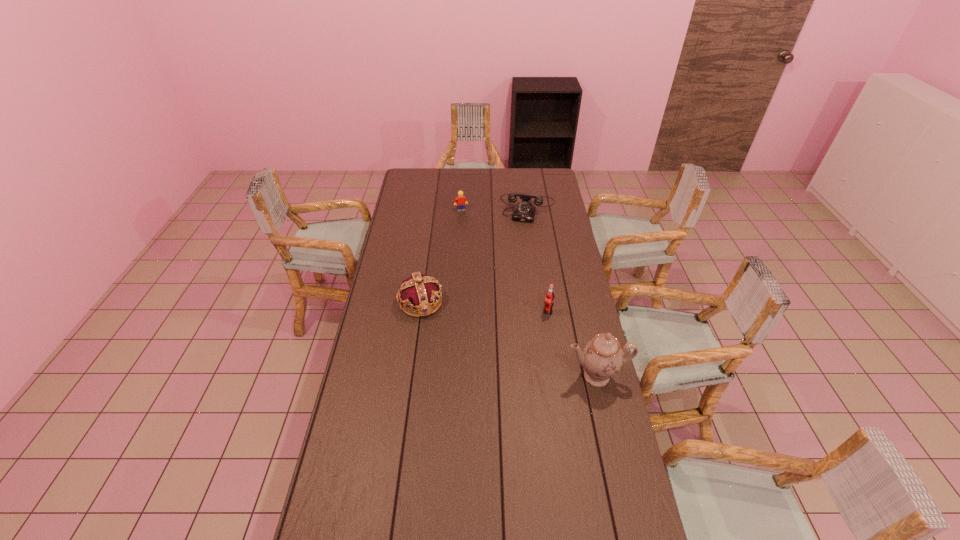
Locate an element on the screen. This screenshot has height=540, width=960. soda bottle positioned at the right edge is located at coordinates (549, 297).

You are a GUI agent. You are given a task and a screenshot of the screen. Output one action in this format:
    pyautogui.click(x=<x>, y=<y>)
    Task: Click on the free location at the far edge of the desktop
    The width and height of the screenshot is (960, 540).
    Given the screenshot: What is the action you would take?
    pyautogui.click(x=449, y=182)

Where is `vacant space at the near edge`? The width and height of the screenshot is (960, 540). vacant space at the near edge is located at coordinates (446, 536).

Find the location of a particular element. The height and width of the screenshot is (540, 960). vacant space at the left edge is located at coordinates (400, 346).

Find the location of a particular element. vacant region at the right edge of the desktop is located at coordinates (558, 368).

Find the location of a particular element. The image size is (960, 540). vacant space at the far right corner is located at coordinates (553, 187).

Identify the location of free space between the fourth object from right to left and the leftmost object. This screenshot has width=960, height=540. (441, 256).

This screenshot has height=540, width=960. I want to click on free area in between the nearest object and the telephone, so click(x=563, y=293).

The height and width of the screenshot is (540, 960). In order to click on vacant space that is in between the crown and the Lego in this screenshot , I will do `click(441, 256)`.

Find the location of a particular element. Image resolution: width=960 pixels, height=540 pixels. empty location between the second object from left to right and the telephone is located at coordinates (494, 210).